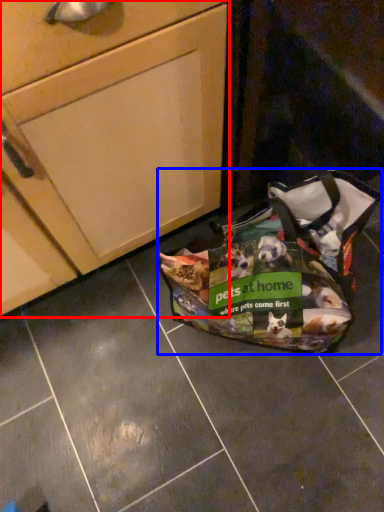
Question: Which of the following is the farthest to the observer, cabinetry (highlighted by a red box) or handbag (highlighted by a blue box)?

Choices:
 (A) cabinetry
 (B) handbag

Answer: (B)